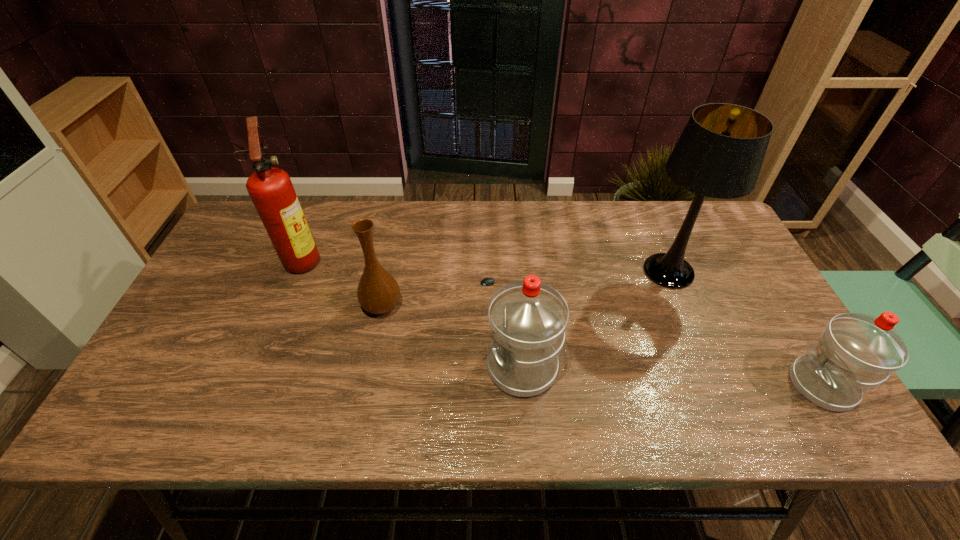
Please point out where to position a new water bottle on the left to maintain spacing. Please provide its 2D coordinates. Your answer should be formatted as a tuple, i.e. [(x, y)], where the tuple contains the x and y coordinates of a point satisfying the conditions above.

[(241, 350)]